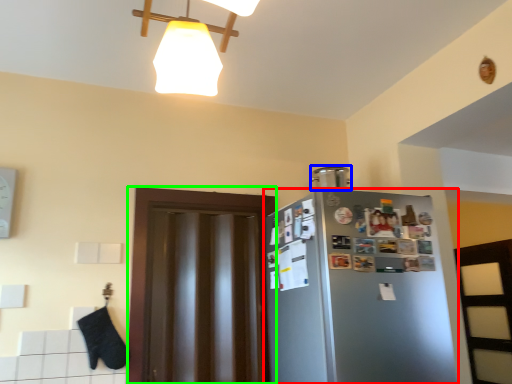
Question: Which object is positioned farthest from refrigerator (highlighted by a red box)? Select from appliance (highlighted by a blue box) and glass door (highlighted by a green box).

Choices:
 (A) appliance
 (B) glass door

Answer: (A)